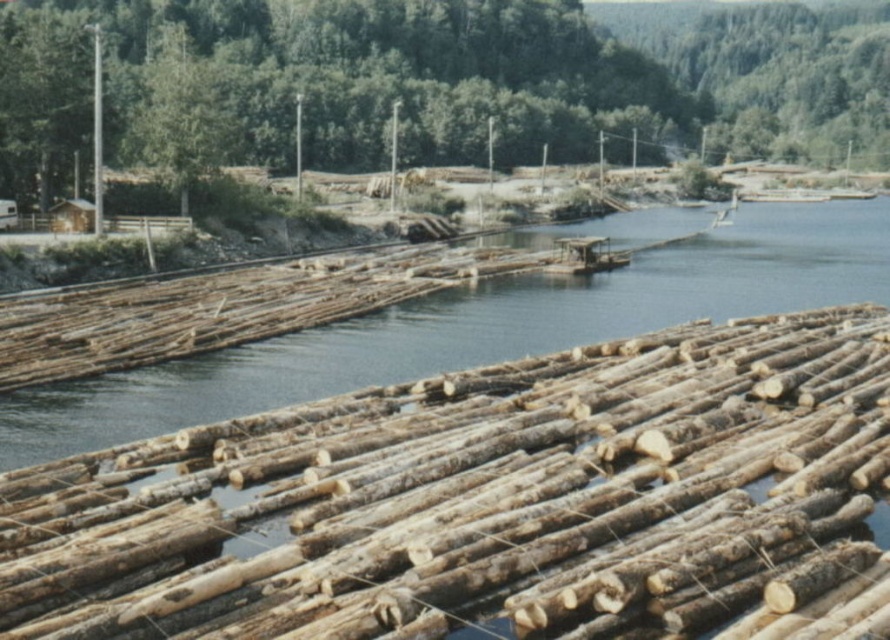
Question: Estimate the real-world distances between objects in this image. Which object is closer to the natural wood logs at center?

Choices:
 (A) natural wood river at center
 (B) green leafy tree at upper center
 (C) green leafy tree at upper left

Answer: (A)

Question: Which point appears closest to the camera in this image?

Choices:
 (A) (152, 132)
 (B) (613, 83)
 (C) (249, 392)

Answer: (C)

Question: Is natural wood river at center wider than green leafy tree at upper left?

Choices:
 (A) no
 (B) yes

Answer: (B)

Question: Which of the following is the farthest from the observer?

Choices:
 (A) (63, 100)
 (B) (463, 342)

Answer: (A)

Question: Is green leafy tree at upper center above green leafy tree at upper left?

Choices:
 (A) yes
 (B) no

Answer: (A)

Question: Can you confirm if natural wood logs at center is bigger than green leafy tree at upper center?

Choices:
 (A) yes
 (B) no

Answer: (B)